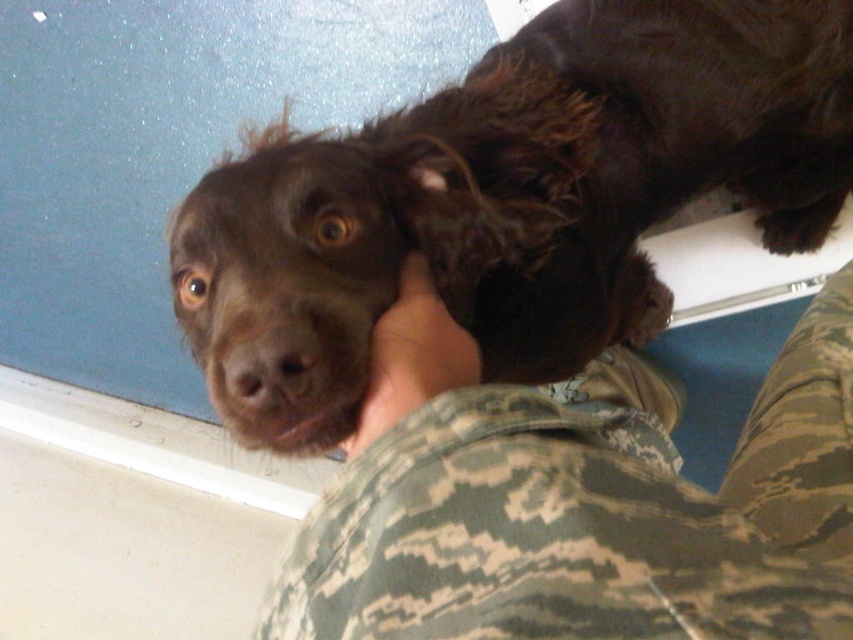
You are a photographer trying to capture the brown furry paw at center and the camo fabric shirt at center in a clear photo. Which object should you focus on first to ensure both are in focus?

The camo fabric shirt at center is in front of the brown furry paw at center, so you should focus on the camo fabric shirt at center first to ensure both are in focus.

You are a photographer trying to capture the perfect shot of the brown dog and the person holding it. You notice two points marked in the image at coordinates point (335, 381) and point (407, 304). Which point is closer to the camera?

Point (335, 381) is in front of point (407, 304), so it is closer to the camera.

You are a photographer trying to capture a close shot of the brown furry dog at center and the camo fabric shirt at center. Since the camera can only focus on one subject at a time, which one should you focus on first if you want to ensure the subject closer to the camera is sharp?

The brown furry dog at center is positioned on the right side of camo fabric shirt at center, so you should focus on the camo fabric shirt at center first since it is closer to the camera.